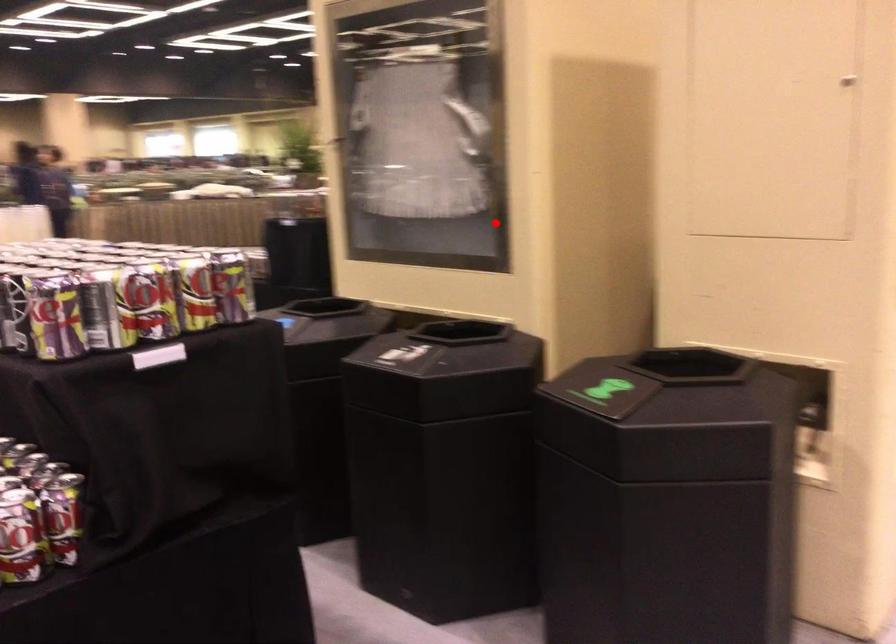
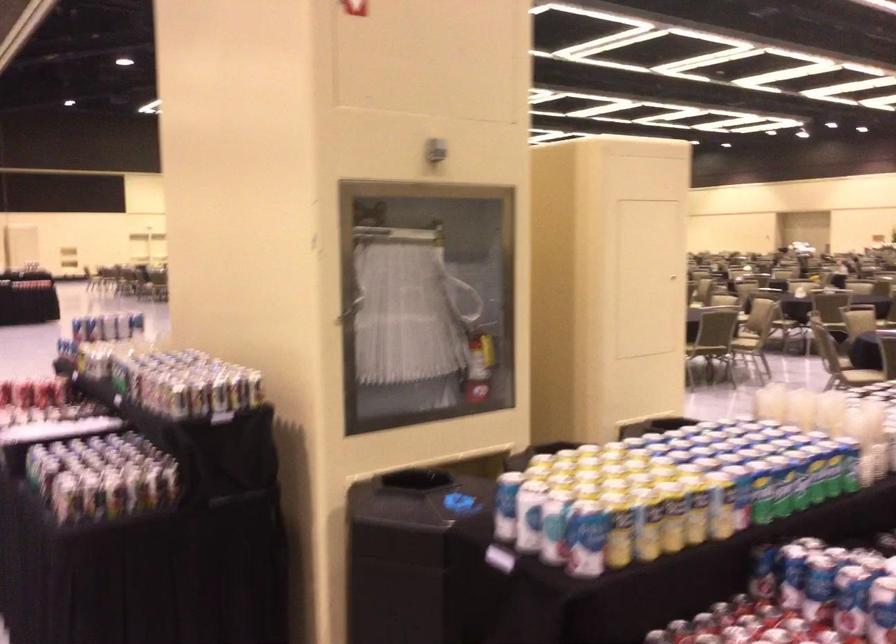
Find the pixel in the second image that matches the highlighted location in the first image.

(478, 365)